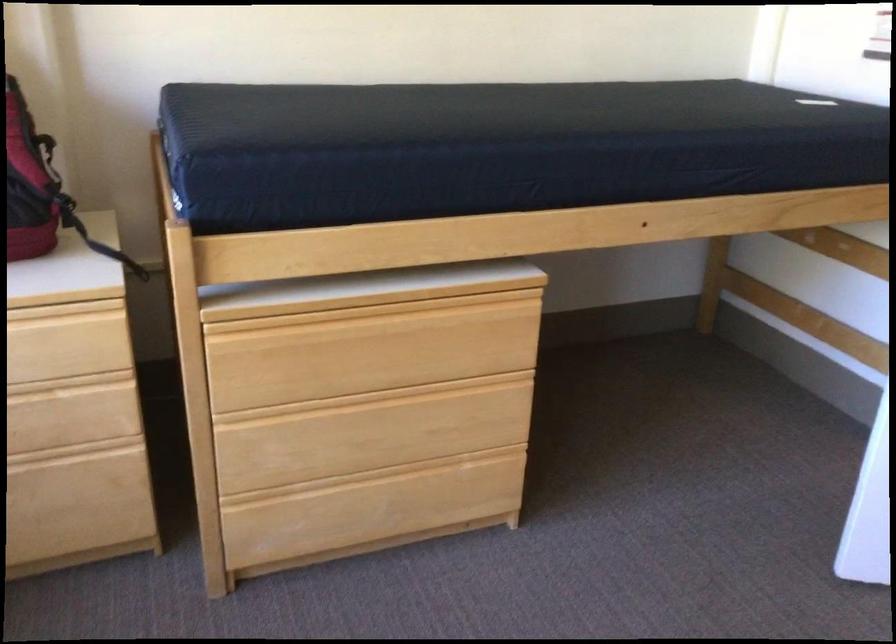
Find where to lift the black backpack strap. Please return your answer as a coordinate pair (x, y).

(101, 245)